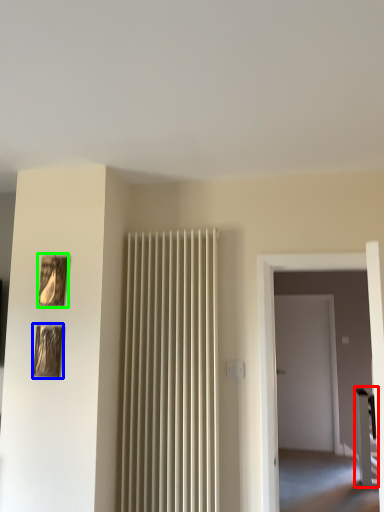
Question: Estimate the real-world distances between objects in this image. Which object is farther from furniture (highlighted by a red box), picture frame (highlighted by a blue box) or picture frame (highlighted by a green box)?

Choices:
 (A) picture frame
 (B) picture frame

Answer: (B)